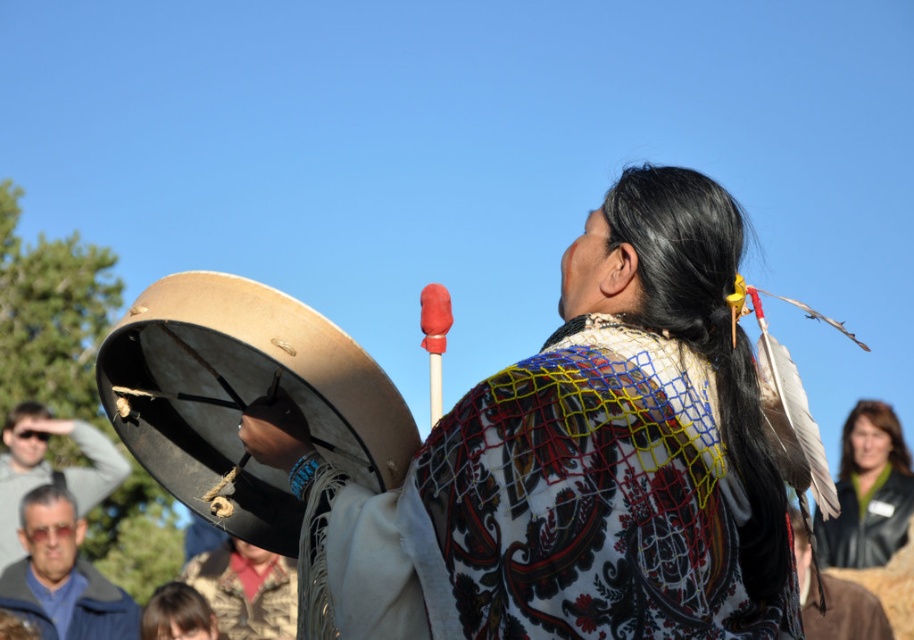
Question: Can you confirm if leather jacket at center is wider than smooth brown hair at lower left?

Choices:
 (A) no
 (B) yes

Answer: (B)

Question: Considering the real-world distances, which object is closest to the matte gray sunglasses at lower left?

Choices:
 (A) leather jacket at center
 (B) textured fabric shawl at center

Answer: (A)

Question: Which of these objects is positioned closest to the blue denim jacket at lower left?

Choices:
 (A) camouflage jacket at lower center
 (B) leather jacket at center
 (C) textured fabric shawl at center
 (D) matte brown drum at center

Answer: (A)

Question: Can you confirm if leather jacket at center is positioned below smooth brown hair at lower left?

Choices:
 (A) yes
 (B) no

Answer: (B)

Question: Does blue denim jacket at lower left have a smaller size compared to matte gray sunglasses at lower left?

Choices:
 (A) no
 (B) yes

Answer: (B)

Question: Which object appears closest to the camera in this image?

Choices:
 (A) blue denim jacket at lower left
 (B) matte gray sunglasses at lower left
 (C) leather jacket at center

Answer: (C)